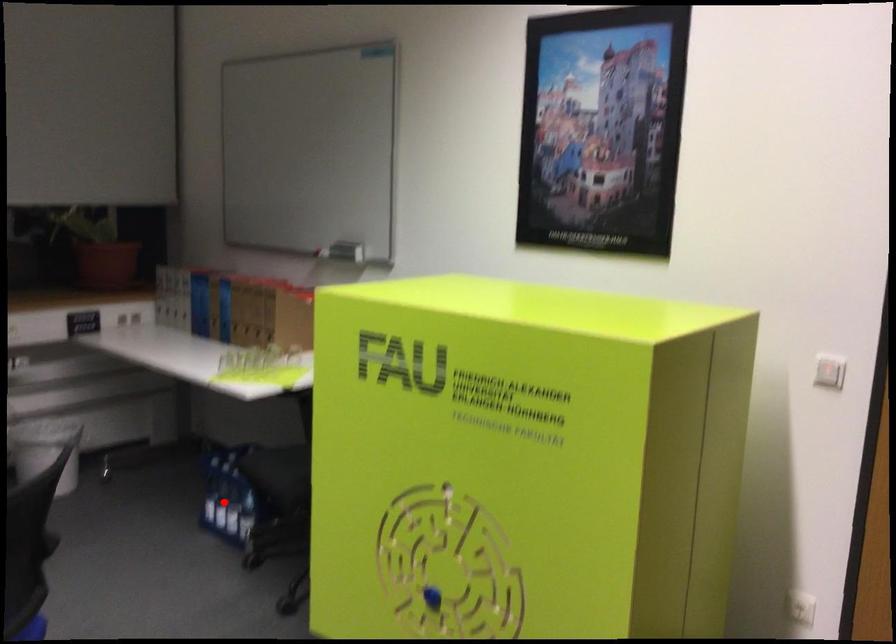
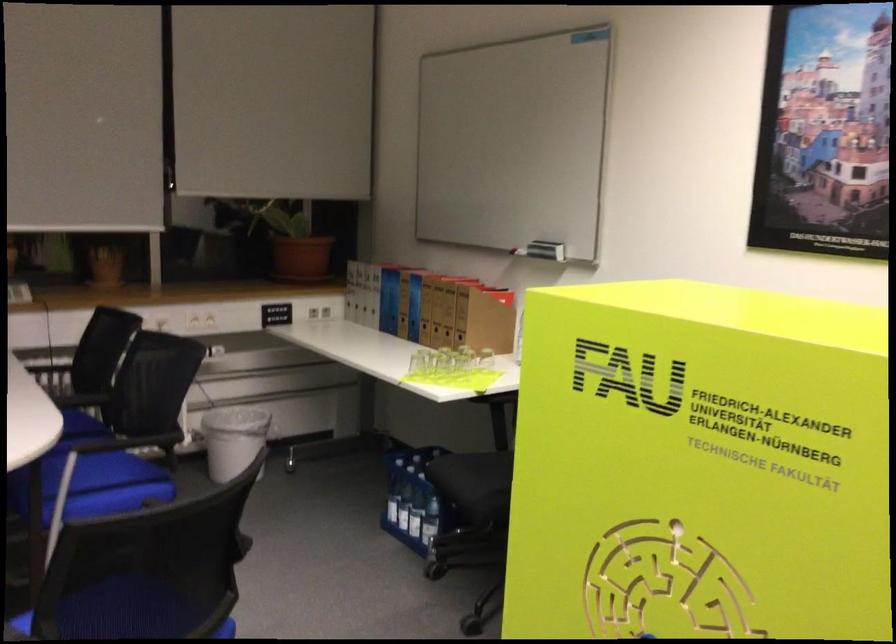
The point at the highlighted location is marked in the first image. Where is the corresponding point in the second image?

(403, 507)